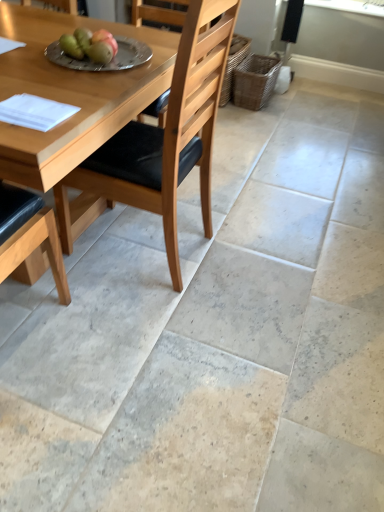
This screenshot has width=384, height=512. Identify the location of vacant area located to the right-hand side of white paper at lower left. (87, 112).